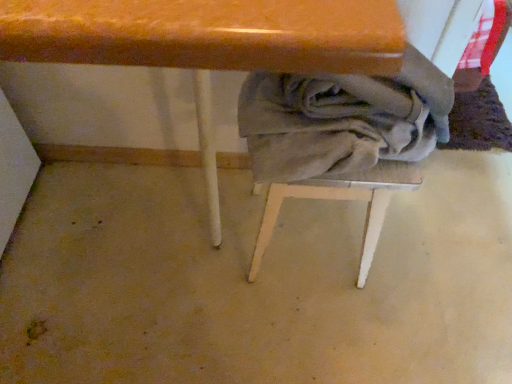
Where is `wooden table at center`? This screenshot has width=512, height=384. wooden table at center is located at coordinates (206, 43).

In order to face gray fabric-covered stool at center, should I rotate leftwards or rightwards?

A 7.900 degree turn to the right will do.

The image size is (512, 384). What are the coordinates of `wooden table at center` in the screenshot? It's located at (206, 43).

Between gray fabric-covered stool at center and wooden table at center, which one has smaller width?

gray fabric-covered stool at center is thinner.

Is gray fabric-covered stool at center outside of wooden table at center?

Actually, gray fabric-covered stool at center is within wooden table at center.

Considering the positions of points (417, 165) and (345, 68), is point (417, 165) closer to camera compared to point (345, 68)?

No, it is behind (345, 68).

Can you confirm if gray fabric-covered stool at center is bigger than gray cotton laundry at lower center?

Indeed, gray fabric-covered stool at center has a larger size compared to gray cotton laundry at lower center.

How much distance is there between gray fabric-covered stool at center and gray cotton laundry at lower center?

The distance of gray fabric-covered stool at center from gray cotton laundry at lower center is 4.52 inches.

Is gray fabric-covered stool at center turned away from gray cotton laundry at lower center?

gray fabric-covered stool at center is not turned away from gray cotton laundry at lower center.

Would you say gray fabric-covered stool at center contains gray cotton laundry at lower center?

No, gray cotton laundry at lower center is not a part of gray fabric-covered stool at center.

Locate an element on the screen. step stool below the gray cotton laundry at lower center (from the image's perspective) is located at coordinates (340, 199).

Is gray cotton laundry at lower center outside of gray fabric-covered stool at center?

gray cotton laundry at lower center is positioned outside gray fabric-covered stool at center.

From the image's perspective, is gray cotton laundry at lower center on gray fabric-covered stool at center?

Yes, from the image's perspective, gray cotton laundry at lower center is above gray fabric-covered stool at center.

Between wooden table at center and gray fabric-covered stool at center, which one appears on the right side from the viewer's perspective?

Positioned to the right is gray fabric-covered stool at center.

Are wooden table at center and gray fabric-covered stool at center far apart?

Actually, wooden table at center and gray fabric-covered stool at center are a little close together.

From a real-world perspective, who is located higher, wooden table at center or gray fabric-covered stool at center?

wooden table at center.

Does wooden table at center have a lesser height compared to gray cotton laundry at lower center?

Incorrect, the height of wooden table at center does not fall short of that of gray cotton laundry at lower center.

Is wooden table at center positioned far away from gray cotton laundry at lower center?

No, wooden table at center is not far away from gray cotton laundry at lower center.

Which object is wider, wooden table at center or gray cotton laundry at lower center?

Wider between the two is wooden table at center.

Is wooden table at center surrounded by gray cotton laundry at lower center?

Actually, wooden table at center is outside gray cotton laundry at lower center.

From the image's perspective, between gray cotton laundry at lower center and wooden table at center, who is located below?

wooden table at center is shown below in the image.

Is gray cotton laundry at lower center facing away from wooden table at center?

That's not correct — gray cotton laundry at lower center is not looking away from wooden table at center.

Image resolution: width=512 pixels, height=384 pixels. There is a gray fabric-covered stool at center. In order to click on table above it (from a real-world perspective) in this screenshot , I will do 206,43.

This screenshot has height=384, width=512. What are the coordinates of `step stool on the left side of gray cotton laundry at lower center` in the screenshot? It's located at (340, 199).

Considering their positions, is gray fabric-covered stool at center positioned further to wooden table at center than gray cotton laundry at lower center?

gray fabric-covered stool at center is further to wooden table at center.

Based on their spatial positions, is gray cotton laundry at lower center or gray fabric-covered stool at center closer to wooden table at center?

Based on the image, gray cotton laundry at lower center appears to be nearer to wooden table at center.

Considering their positions, is gray fabric-covered stool at center positioned closer to gray cotton laundry at lower center than wooden table at center?

Based on the image, gray fabric-covered stool at center appears to be nearer to gray cotton laundry at lower center.

Based on the photo, from the image, which object appears to be nearer to gray fabric-covered stool at center, gray cotton laundry at lower center or wooden table at center?

gray cotton laundry at lower center lies closer to gray fabric-covered stool at center than the other object.

Considering their positions, is wooden table at center positioned closer to gray fabric-covered stool at center than gray cotton laundry at lower center?

Among the two, gray cotton laundry at lower center is located nearer to gray fabric-covered stool at center.

Based on their spatial positions, is wooden table at center or gray fabric-covered stool at center further from gray cotton laundry at lower center?

Among the two, wooden table at center is located further to gray cotton laundry at lower center.

Find the location of `step stool located between wooden table at center and gray cotton laundry at lower center in the left-right direction`. step stool located between wooden table at center and gray cotton laundry at lower center in the left-right direction is located at coordinates (340, 199).